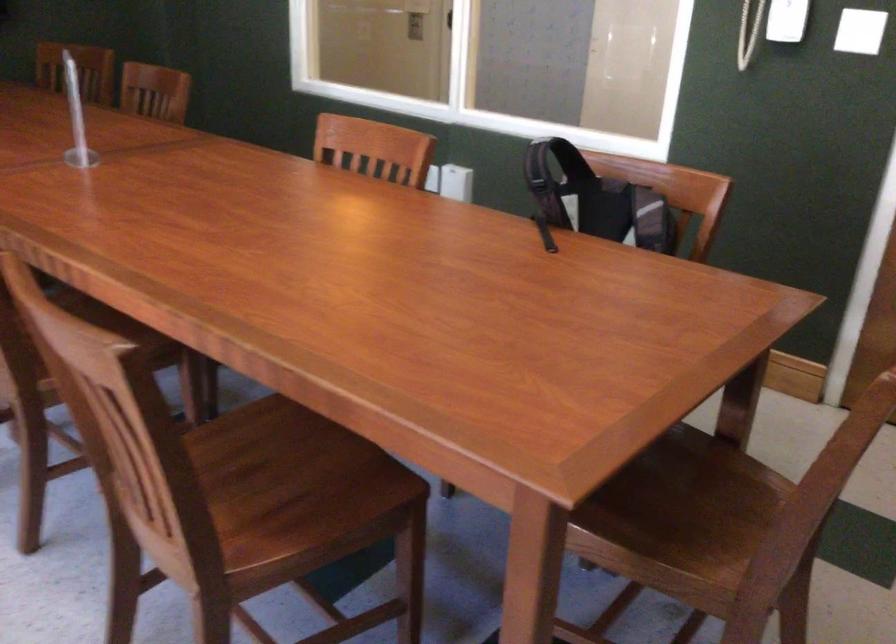
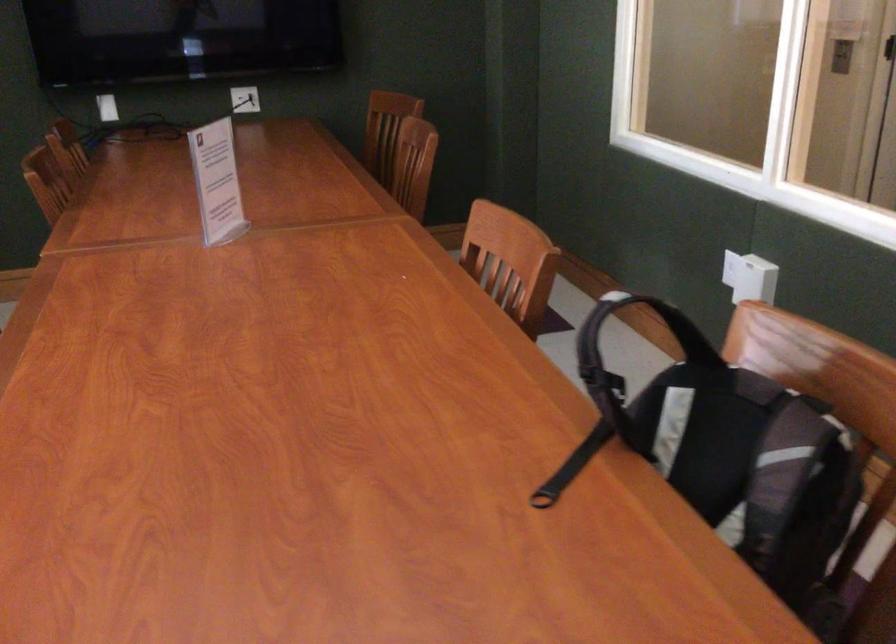
In the second image, find the point that corresponds to (545,237) in the first image.

(572, 466)